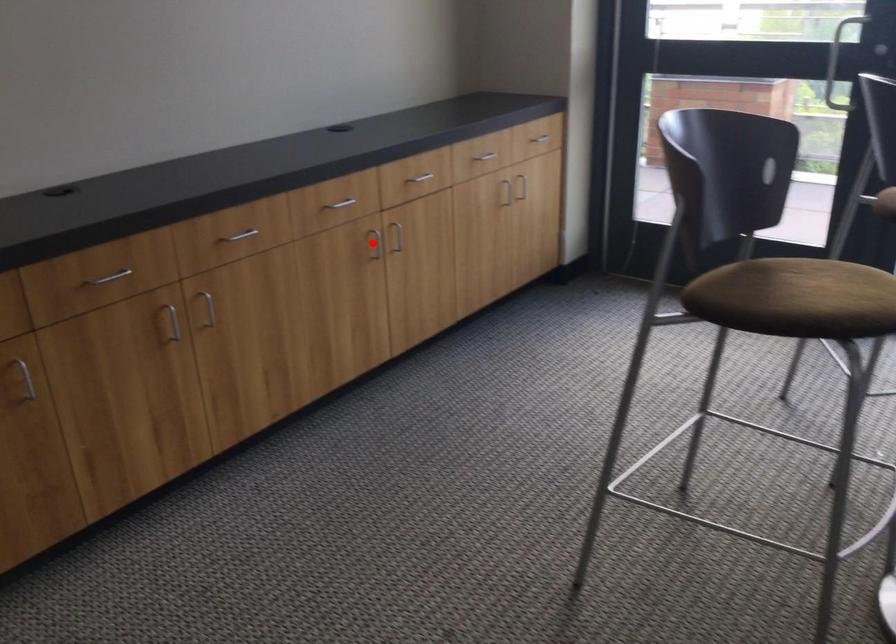
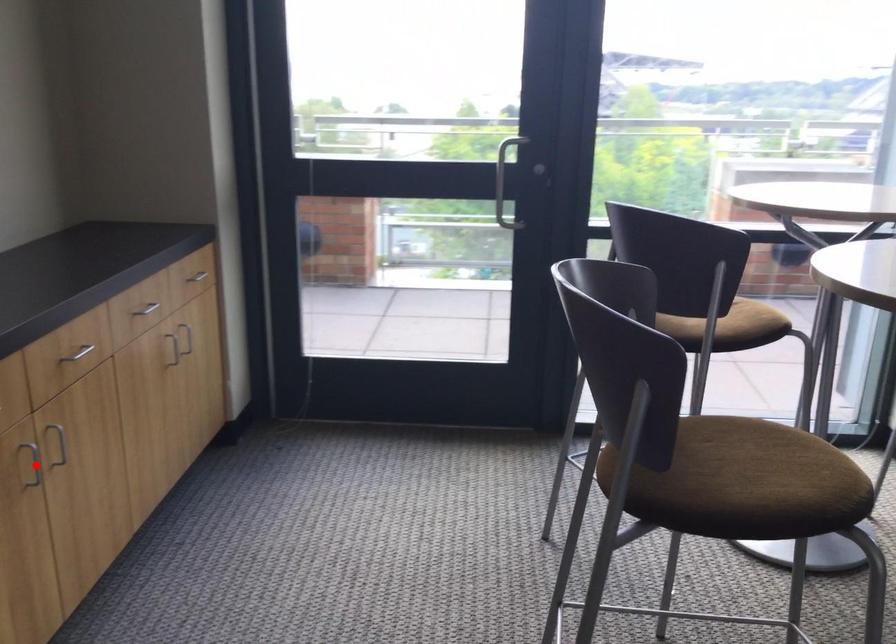
I am providing you with two images of the same scene from different viewpoints. A red point is marked on the first image and another point is marked on the second image. Is the red point in image1 aligned with the point shown in image2?

Yes